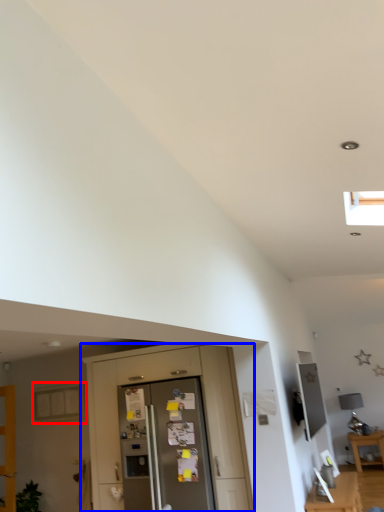
Question: Which of the following is the closest to the observer, window (highlighted by a red box) or dresser (highlighted by a blue box)?

Choices:
 (A) window
 (B) dresser

Answer: (B)